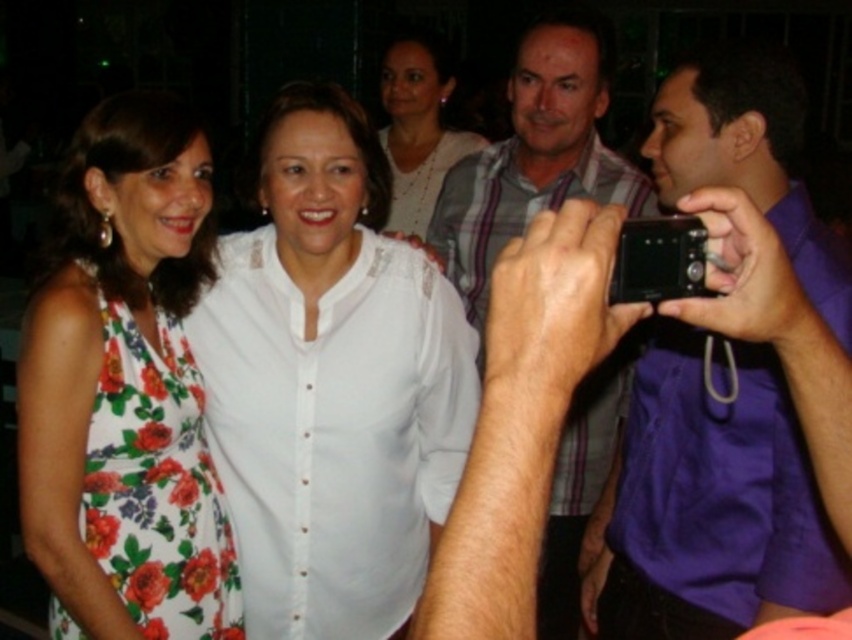
Question: Which of the following is the farthest from the observer?

Choices:
 (A) white sheer shirt at center
 (B) striped cotton shirt at center

Answer: (B)

Question: Is purple fabric shirt at right bigger than matte white blouse at center?

Choices:
 (A) yes
 (B) no

Answer: (B)

Question: Which object is farther from the camera taking this photo?

Choices:
 (A) floral print fabric dress at left
 (B) purple fabric shirt at right
 (C) striped cotton shirt at center
 (D) floral dress at center

Answer: (C)

Question: Which object is closer to the camera taking this photo?

Choices:
 (A) white sheer shirt at center
 (B) floral print fabric dress at left

Answer: (B)

Question: Is purple fabric shirt at right to the right of black plastic camera at upper right from the viewer's perspective?

Choices:
 (A) no
 (B) yes

Answer: (B)

Question: Is striped cotton shirt at center below matte white blouse at center?

Choices:
 (A) yes
 (B) no

Answer: (A)